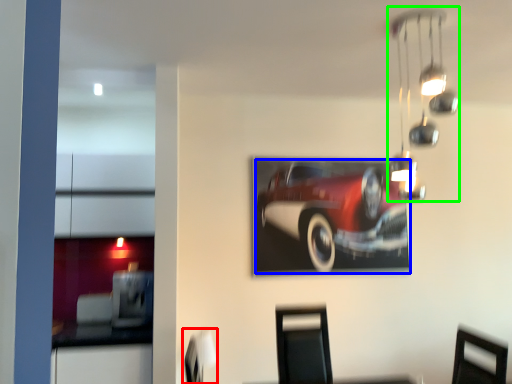
Question: Which object is the farthest from swivel chair (highlighted by a red box)? Choose among these: car (highlighted by a blue box) or lamp (highlighted by a green box).

Choices:
 (A) car
 (B) lamp

Answer: (B)